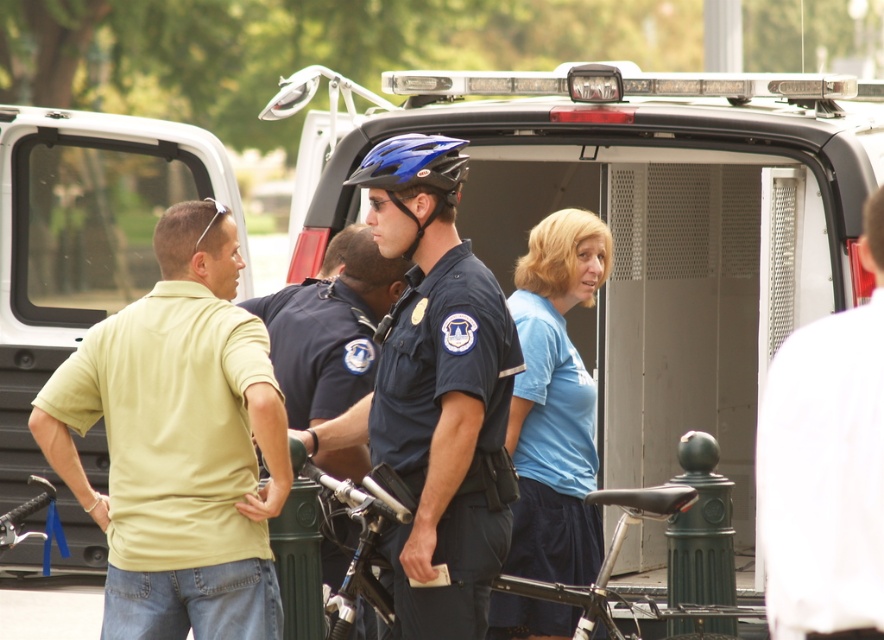
Question: Can you confirm if metallic silver van at center is smaller than white matte shirt at upper right?

Choices:
 (A) yes
 (B) no

Answer: (B)

Question: Is metallic silver van at center closer to camera compared to light yellow shirt at center?

Choices:
 (A) yes
 (B) no

Answer: (B)

Question: Is matte yellow shirt at left smaller than light yellow shirt at center?

Choices:
 (A) yes
 (B) no

Answer: (A)

Question: Which object is closer to the camera taking this photo?

Choices:
 (A) light yellow shirt at center
 (B) matte yellow shirt at left
 (C) white matte shirt at upper right
 (D) blue matte helmet at center

Answer: (C)

Question: Which is farther from the blue matte helmet at center?

Choices:
 (A) metallic silver van at center
 (B) blue matte bicycle helmet at center

Answer: (A)

Question: Which point is farther from the camera taking this photo?

Choices:
 (A) (444, 323)
 (B) (859, 353)
 (C) (368, 184)
 (D) (819, 120)

Answer: (D)